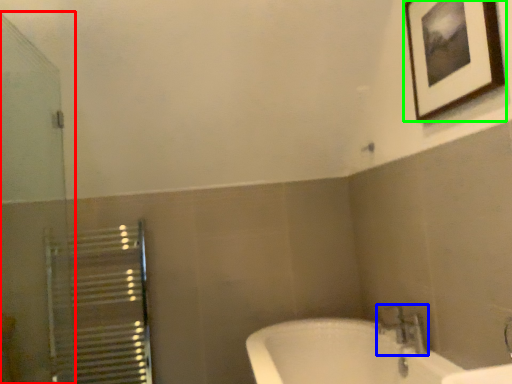
Question: Which object is the closest to the screen door (highlighted by a red box)? Choose among these: tap (highlighted by a blue box) or picture frame (highlighted by a green box).

Choices:
 (A) tap
 (B) picture frame

Answer: (B)